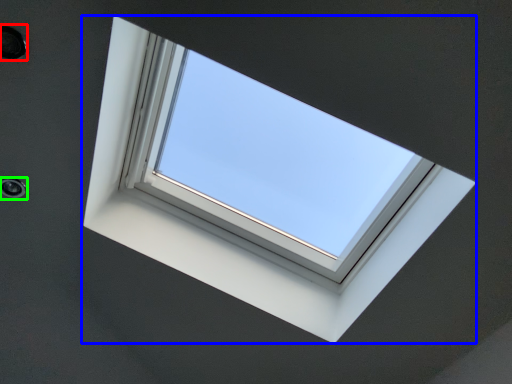
Question: Estimate the real-world distances between objects in this image. Which object is farther from hole (highlighted by a red box), window (highlighted by a blue box) or hole (highlighted by a green box)?

Choices:
 (A) window
 (B) hole

Answer: (A)